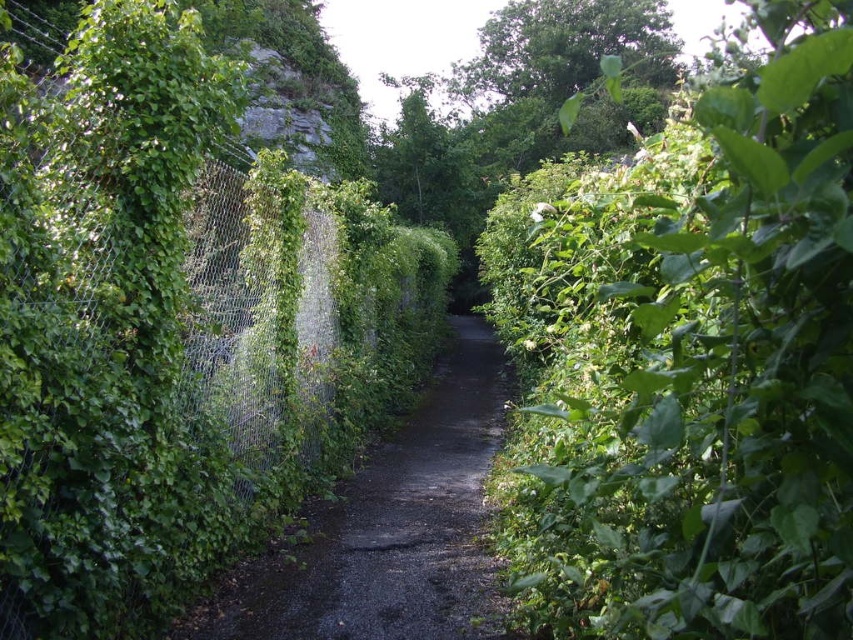
Question: Is green leafy bush at right wider than green leafy tree at center?

Choices:
 (A) yes
 (B) no

Answer: (B)

Question: Which object appears closest to the camera in this image?

Choices:
 (A) dirt/gravel path at center
 (B) green leafy bush at right
 (C) green leafy tree at center

Answer: (B)

Question: Can you confirm if dirt/gravel path at center is positioned below green leafy tree at center?

Choices:
 (A) no
 (B) yes

Answer: (B)

Question: Which object is the farthest from the green leafy bush at right?

Choices:
 (A) dirt/gravel path at center
 (B) green leafy tree at center

Answer: (B)

Question: Which point is farther from the camera taking this photo?

Choices:
 (A) (688, 205)
 (B) (360, 616)

Answer: (B)

Question: From the image, what is the correct spatial relationship of green leafy bush at right in relation to dirt/gravel path at center?

Choices:
 (A) right
 (B) left

Answer: (A)